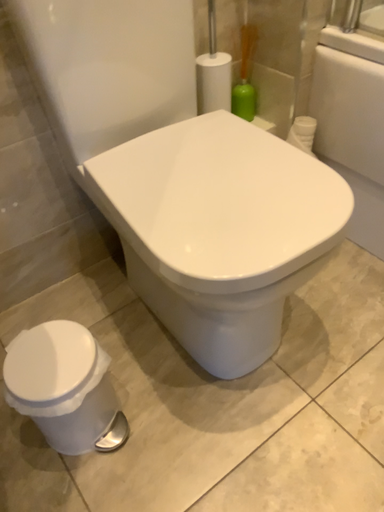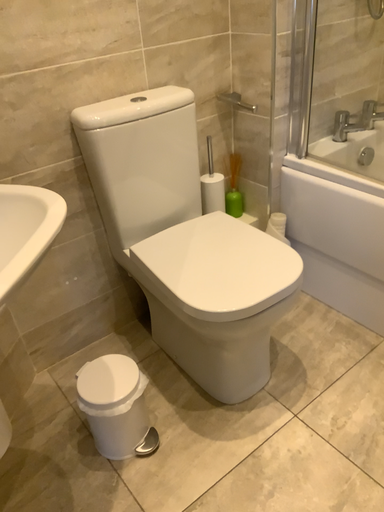
Question: Which way did the camera rotate in the video?

Choices:
 (A) rotated downward
 (B) rotated upward

Answer: (B)